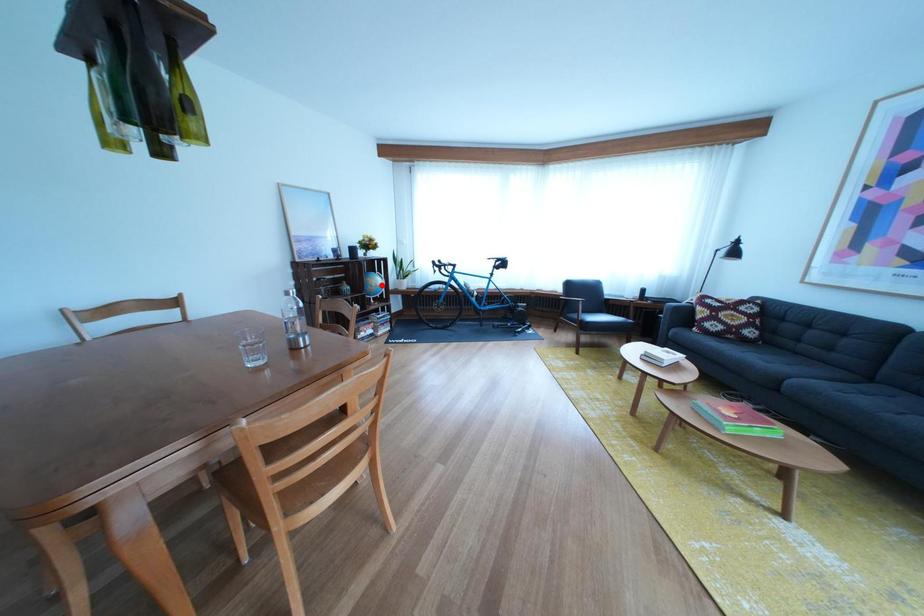
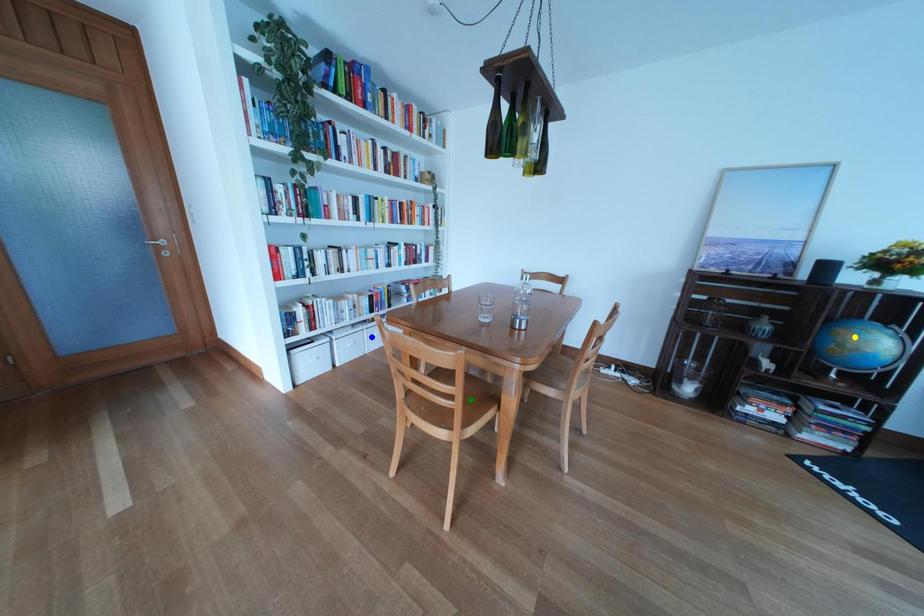
Question: I am providing you with two images of the same scene from different viewpoints. A red point is marked on the first image. You are given multiple points on the second image. Which point in image 2 is actually the same real-world point as the red point in image 1?

Choices:
 (A) yellow point
 (B) green point
 (C) blue point

Answer: (A)